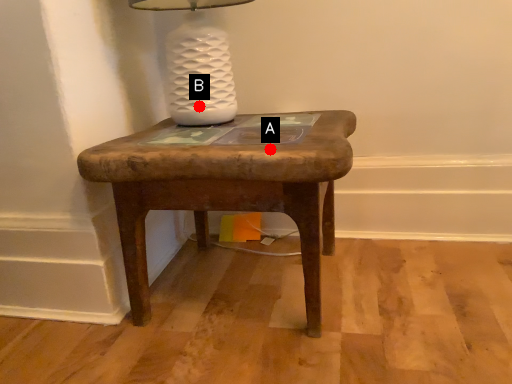
Question: Two points are circled on the image, labeled by A and B beside each circle. Which point appears closest to the camera in this image?

Choices:
 (A) A is closer
 (B) B is closer

Answer: (A)